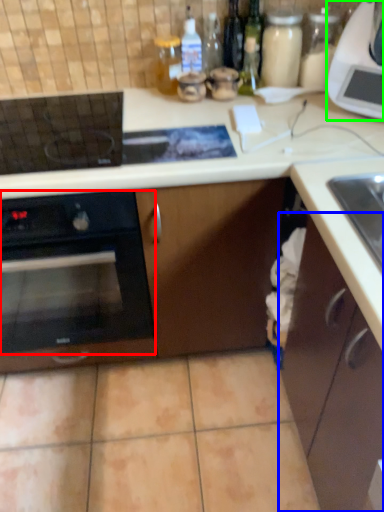
Question: Estimate the real-world distances between objects in this image. Which object is farther from oven (highlighted by a red box), cabinetry (highlighted by a blue box) or kitchen appliance (highlighted by a green box)?

Choices:
 (A) cabinetry
 (B) kitchen appliance

Answer: (B)